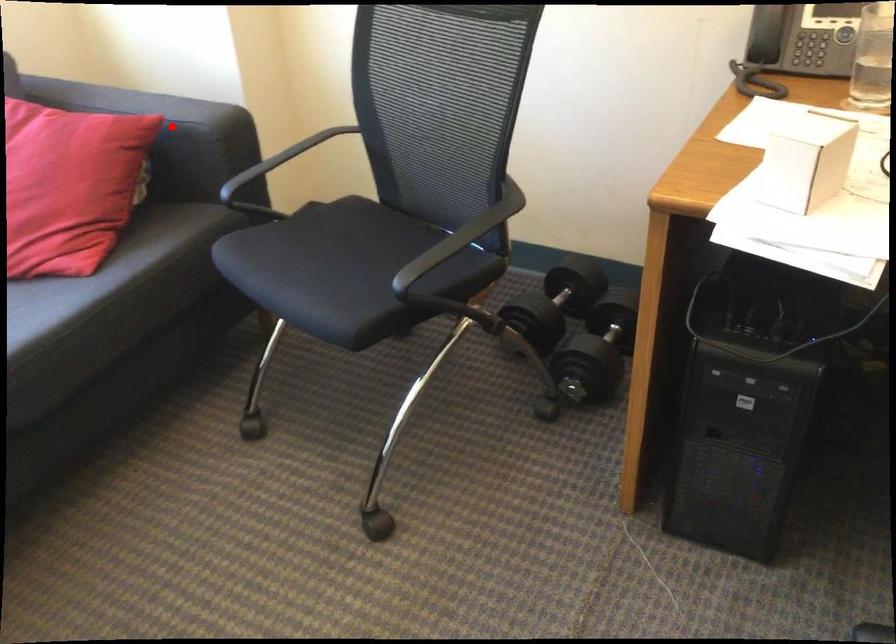
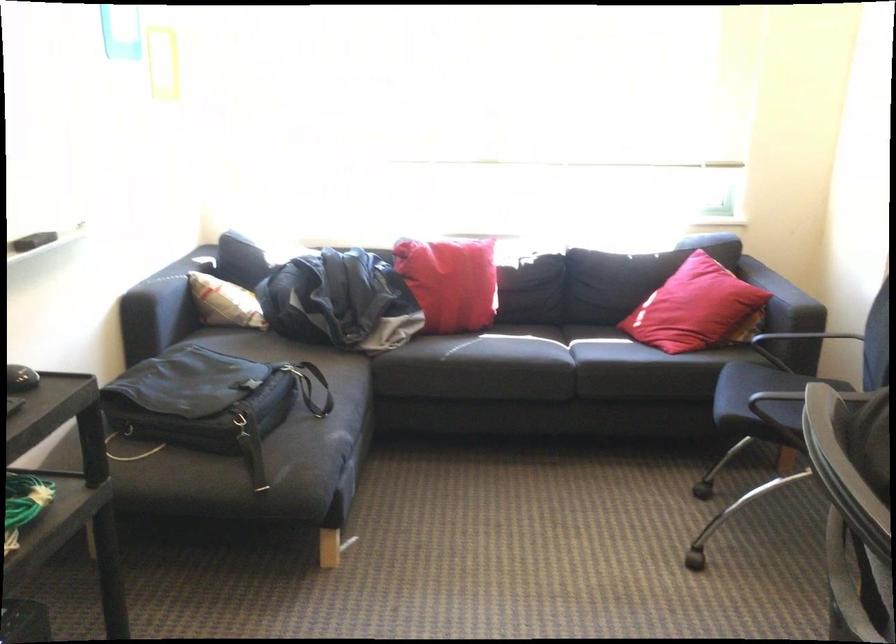
Question: I am providing you with two images of the same scene from different viewpoints. Given a red point in image1, look at the same physical point in image2. Is it:

Choices:
 (A) Closer to the viewpoint
 (B) Farther from the viewpoint

Answer: (B)